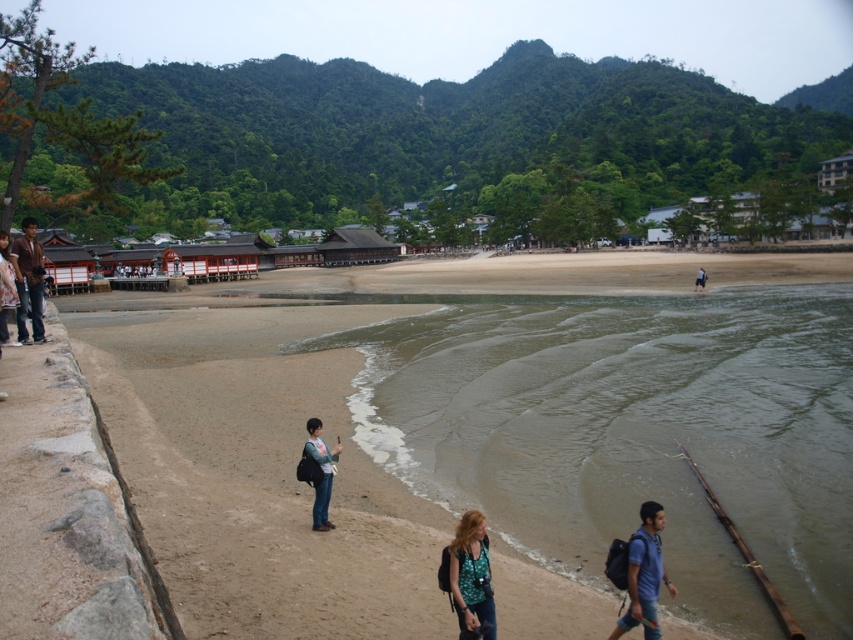
Is green patterned shirt at lower center positioned behind light blue denim jeans at lower center?

No, it is not.

Which of these two, green patterned shirt at lower center or light blue denim jeans at lower center, stands shorter?

Standing shorter between the two is green patterned shirt at lower center.

At what (x,y) coordinates should I click in order to perform the action: click on green patterned shirt at lower center. Please return your answer as a coordinate pair (x, y). Looking at the image, I should click on (471, 576).

Based on the photo, is matte brown jacket at left thinner than light blue denim jeans at lower center?

Indeed, matte brown jacket at left has a lesser width compared to light blue denim jeans at lower center.

In the scene shown: Who is higher up, matte brown jacket at left or light blue denim jeans at lower center?

Positioned higher is light blue denim jeans at lower center.

Is point (35, 284) positioned in front of point (701, 285)?

That is True.

Where is `matte brown jacket at left`? This screenshot has height=640, width=853. matte brown jacket at left is located at coordinates (28, 280).

Is point (805, 282) closer to viewer compared to point (697, 280)?

No, it is behind (697, 280).

Who is higher up, sandy beach at lower left or light blue denim jeans at lower center?

light blue denim jeans at lower center is higher up.

The image size is (853, 640). Describe the element at coordinates (440, 444) in the screenshot. I see `sandy beach at lower left` at that location.

This screenshot has width=853, height=640. I want to click on sandy beach at lower left, so click(x=440, y=444).